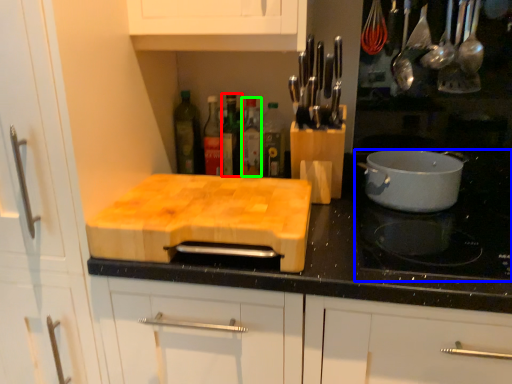
Question: Based on their relative distances, which object is farther from bottle (highlighted by a red box)? Choose from gas stove (highlighted by a blue box) and bottle (highlighted by a green box).

Choices:
 (A) gas stove
 (B) bottle

Answer: (A)